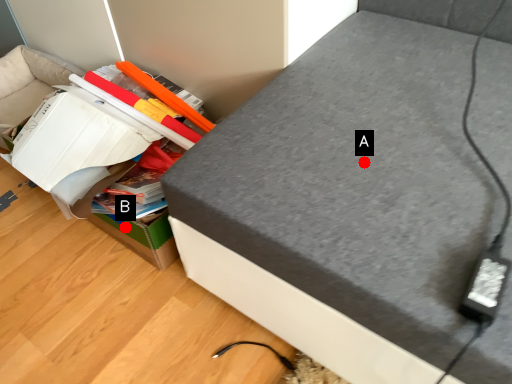
Question: Two points are circled on the image, labeled by A and B beside each circle. Which of the following is the closest to the observer?

Choices:
 (A) A is closer
 (B) B is closer

Answer: (A)